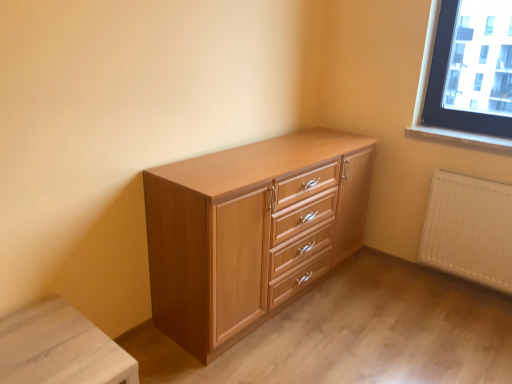
The width and height of the screenshot is (512, 384). I want to click on vacant space to the right of light brown wood chest of drawers at center, so click(399, 311).